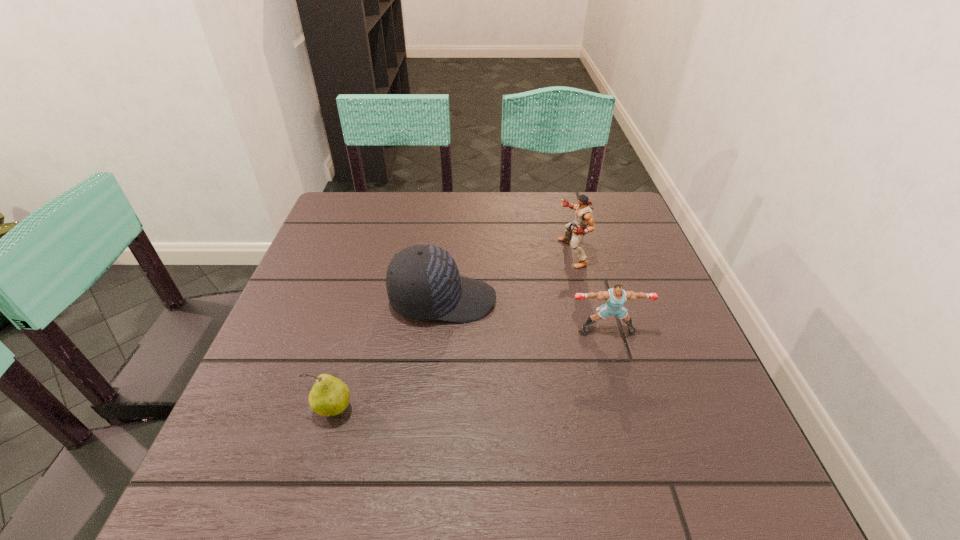
Where is `empty location between the tallest object and the pear`? The height and width of the screenshot is (540, 960). empty location between the tallest object and the pear is located at coordinates (452, 331).

Where is `empty location between the farther puncher and the nearer puncher`? empty location between the farther puncher and the nearer puncher is located at coordinates (589, 291).

Locate an element on the screen. The width and height of the screenshot is (960, 540). the second closest object to the third object from right to left is located at coordinates (584, 217).

Locate an element on the screen. This screenshot has height=540, width=960. object that is the third closest to the second object from left to right is located at coordinates (329, 396).

I want to click on vacant space that satisfies the following two spatial constraints: 1. at the front of the baseball cap where the brim is located; 2. on the front side of the pear, so click(433, 409).